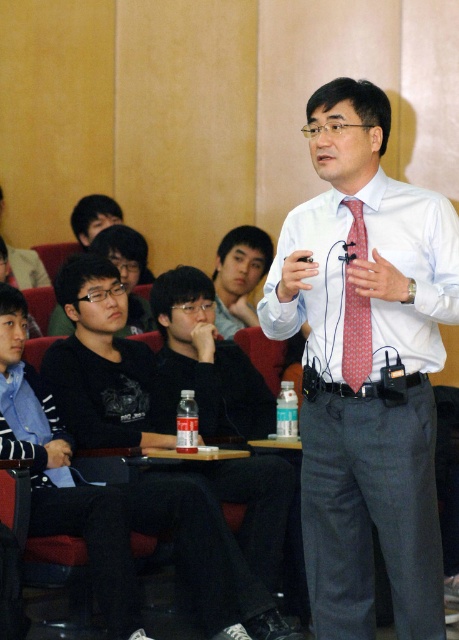
Who is more forward, [236,568] or [348,237]?

Positioned in front is point [348,237].

Which of these two, black shirt at left or red dotted tie at center, stands shorter?

Standing shorter between the two is red dotted tie at center.

This screenshot has width=459, height=640. In order to click on black shirt at left in this screenshot , I will do `click(104, 365)`.

Between white shirt at center and red dotted tie at center, which one appears on the left side from the viewer's perspective?

Positioned to the left is red dotted tie at center.

Can you confirm if white shirt at center is positioned to the left of red dotted tie at center?

Incorrect, white shirt at center is not on the left side of red dotted tie at center.

Find the location of a particular element. Image resolution: width=459 pixels, height=640 pixels. white shirt at center is located at coordinates (365, 365).

Does white smooth shirt at center appear under red dotted tie at center?

Incorrect, white smooth shirt at center is not positioned below red dotted tie at center.

Is white smooth shirt at center bigger than red dotted tie at center?

Indeed, white smooth shirt at center has a larger size compared to red dotted tie at center.

Find the location of a particular element. The width and height of the screenshot is (459, 640). white smooth shirt at center is located at coordinates (370, 260).